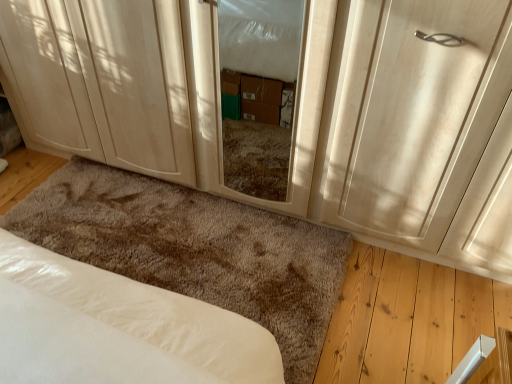
Question: Can you confirm if matte wood door at center is wider than transparent glass screen door at center?

Choices:
 (A) no
 (B) yes

Answer: (B)

Question: Considering the relative positions of matte wood door at center and transparent glass screen door at center in the image provided, is matte wood door at center in front of transparent glass screen door at center?

Choices:
 (A) yes
 (B) no

Answer: (A)

Question: Is matte wood door at center smaller than transparent glass screen door at center?

Choices:
 (A) no
 (B) yes

Answer: (A)

Question: Could you tell me if matte wood door at center is turned towards transparent glass screen door at center?

Choices:
 (A) yes
 (B) no

Answer: (B)

Question: Is matte wood door at center far away from transparent glass screen door at center?

Choices:
 (A) yes
 (B) no

Answer: (B)

Question: Is matte wood door at center wider or thinner than matte wood cabinet at lower left?

Choices:
 (A) thin
 (B) wide

Answer: (A)

Question: Considering the relative positions of matte wood door at center and matte wood cabinet at lower left in the image provided, is matte wood door at center to the left or to the right of matte wood cabinet at lower left?

Choices:
 (A) right
 (B) left

Answer: (A)

Question: Is matte wood door at center in front of or behind matte wood cabinet at lower left in the image?

Choices:
 (A) behind
 (B) front

Answer: (B)

Question: Considering the positions of matte wood door at center and matte wood cabinet at lower left in the image, is matte wood door at center taller or shorter than matte wood cabinet at lower left?

Choices:
 (A) tall
 (B) short

Answer: (A)

Question: Considering the relative positions of matte wood door at center and transparent glass screen door at center in the image provided, is matte wood door at center to the left or to the right of transparent glass screen door at center?

Choices:
 (A) left
 (B) right

Answer: (B)

Question: In terms of height, does matte wood door at center look taller or shorter compared to transparent glass screen door at center?

Choices:
 (A) short
 (B) tall

Answer: (B)

Question: From a real-world perspective, is matte wood door at center above or below transparent glass screen door at center?

Choices:
 (A) above
 (B) below

Answer: (A)

Question: Considering the positions of point (418, 94) and point (198, 29), is point (418, 94) closer or farther from the camera than point (198, 29)?

Choices:
 (A) closer
 (B) farther

Answer: (A)

Question: From a real-world perspective, relative to white soft bed at lower left, is transparent glass screen door at center vertically above or below?

Choices:
 (A) below
 (B) above

Answer: (B)

Question: In terms of size, does transparent glass screen door at center appear bigger or smaller than white soft bed at lower left?

Choices:
 (A) small
 (B) big

Answer: (A)